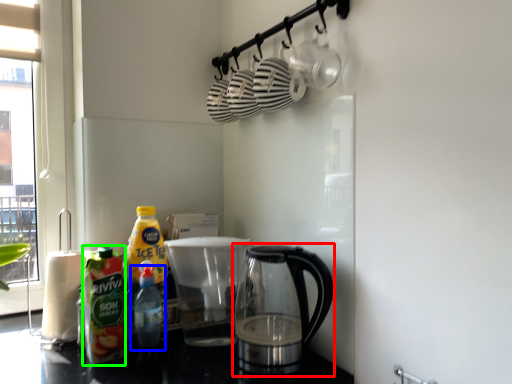
Question: Which object is the farthest from kettle (highlighted by a red box)? Choose among these: bottle (highlighted by a blue box) or bottle (highlighted by a green box).

Choices:
 (A) bottle
 (B) bottle

Answer: (B)